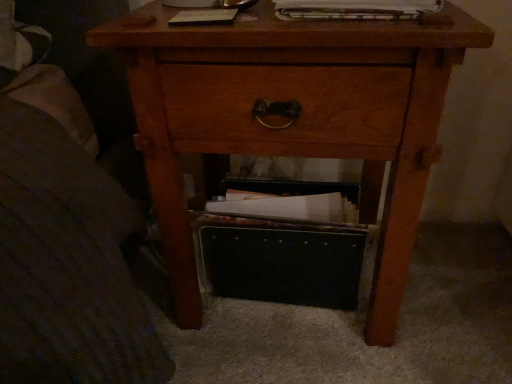
Question: Does wooden nightstand at center turn towards printed paper magazine at upper center?

Choices:
 (A) yes
 (B) no

Answer: (B)

Question: Does wooden nightstand at center have a larger size compared to printed paper magazine at upper center?

Choices:
 (A) yes
 (B) no

Answer: (A)

Question: From the image's perspective, is wooden nightstand at center on top of printed paper magazine at upper center?

Choices:
 (A) yes
 (B) no

Answer: (B)

Question: Considering the relative sizes of wooden nightstand at center and printed paper magazine at upper center in the image provided, is wooden nightstand at center taller than printed paper magazine at upper center?

Choices:
 (A) yes
 (B) no

Answer: (A)

Question: From a real-world perspective, is wooden nightstand at center beneath printed paper magazine at upper center?

Choices:
 (A) no
 (B) yes

Answer: (B)

Question: From the image's perspective, is wooden nightstand at center under printed paper magazine at upper center?

Choices:
 (A) no
 (B) yes

Answer: (B)

Question: Is printed paper magazine at upper center taller than black leather shoe box at lower center?

Choices:
 (A) no
 (B) yes

Answer: (A)

Question: Is printed paper magazine at upper center positioned beyond the bounds of black leather shoe box at lower center?

Choices:
 (A) no
 (B) yes

Answer: (B)

Question: Does printed paper magazine at upper center lie in front of black leather shoe box at lower center?

Choices:
 (A) no
 (B) yes

Answer: (B)

Question: From the image's perspective, is printed paper magazine at upper center located beneath black leather shoe box at lower center?

Choices:
 (A) no
 (B) yes

Answer: (A)

Question: Is printed paper magazine at upper center to the left of black leather shoe box at lower center from the viewer's perspective?

Choices:
 (A) yes
 (B) no

Answer: (B)

Question: Does printed paper magazine at upper center have a lesser height compared to black leather shoe box at lower center?

Choices:
 (A) no
 (B) yes

Answer: (B)

Question: From the image's perspective, does printed paper magazine at upper center appear lower than wooden nightstand at center?

Choices:
 (A) yes
 (B) no

Answer: (B)